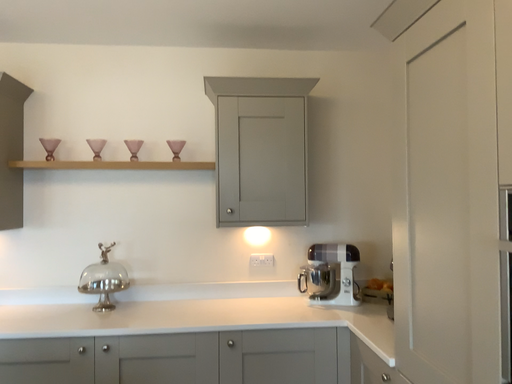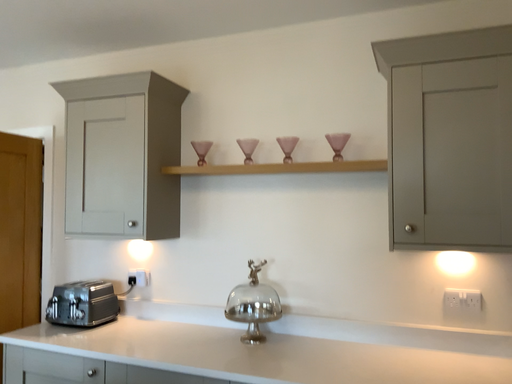
Question: How did the camera likely rotate when shooting the video?

Choices:
 (A) rotated right
 (B) rotated left

Answer: (B)